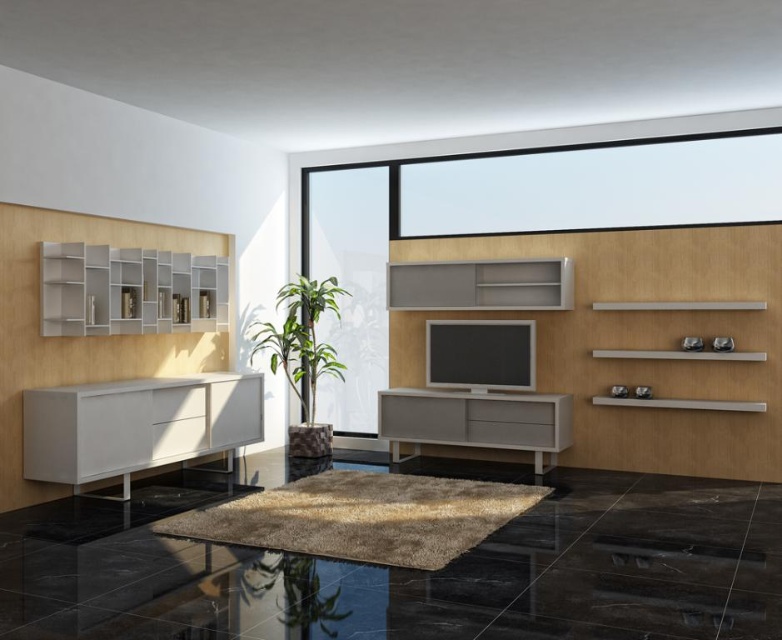
You are standing in the living room and want to place a 3 meter long sofa. The sofa needs to be placed in a straight line from where you are standing to the transparent glass table at lower center. Is there enough space to fit the sofa without bending it?

The transparent glass table at lower center and viewer are 2.93 meters apart from each other. Since the sofa is 3 meters long, it would require slightly more space than the available distance. Therefore, the sofa cannot be placed in a straight line without bending it.